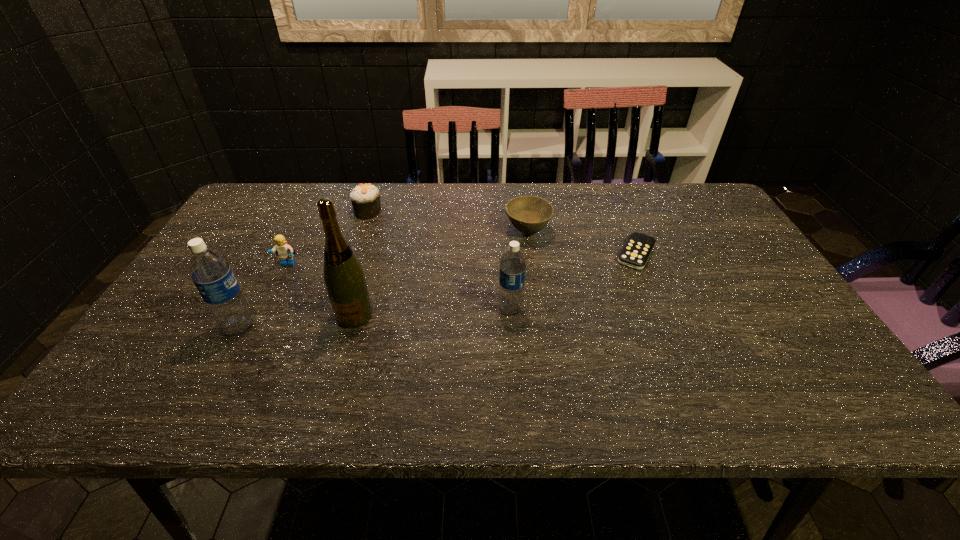
All water bottles are currently evenly spaced. To continue this pattern, where would you add another water bottle on the right? Please point out a vacant spot. Please provide its 2D coordinates. Your answer should be formatted as a tuple, i.e. [(x, y)], where the tuple contains the x and y coordinates of a point satisfying the conditions above.

[(760, 292)]